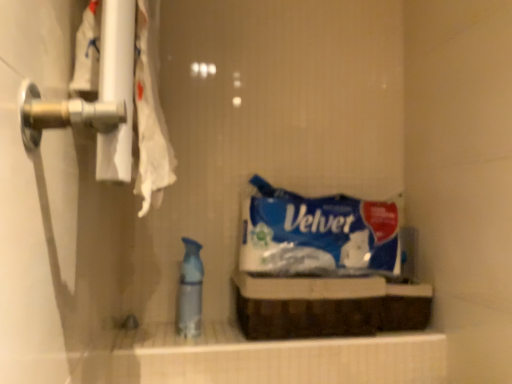
In order to face translucent plastic spray bottle at center, should I rotate leftwards or rightwards?

It's best to rotate left around 8.387 degrees.

Describe the element at coordinates (190, 290) in the screenshot. The image size is (512, 384). I see `translucent plastic spray bottle at center` at that location.

At what (x,y) coordinates should I click in order to perform the action: click on translucent plastic spray bottle at center. Please return your answer as a coordinate pair (x, y). The height and width of the screenshot is (384, 512). Looking at the image, I should click on click(x=190, y=290).

The height and width of the screenshot is (384, 512). What do you see at coordinates (318, 234) in the screenshot?
I see `blue paper towel at center` at bounding box center [318, 234].

Where is `blue paper towel at center`? Image resolution: width=512 pixels, height=384 pixels. blue paper towel at center is located at coordinates pos(318,234).

Where is `translucent plastic spray bottle at center`? The image size is (512, 384). translucent plastic spray bottle at center is located at coordinates (190, 290).

Considering the relative positions of translucent plastic spray bottle at center and blue paper towel at center in the image provided, is translucent plastic spray bottle at center to the left or to the right of blue paper towel at center?

In the image, translucent plastic spray bottle at center appears on the left side of blue paper towel at center.

Does translucent plastic spray bottle at center come behind blue paper towel at center?

→ No, translucent plastic spray bottle at center is in front of blue paper towel at center.

Is point (188, 294) positioned before point (322, 265)?

Yes, point (188, 294) is in front of point (322, 265).

From the picture: From the image's perspective, is translucent plastic spray bottle at center over blue paper towel at center?

No, from the image's perspective, translucent plastic spray bottle at center is not over blue paper towel at center.

From a real-world perspective, relative to blue paper towel at center, is translucent plastic spray bottle at center vertically above or below?

translucent plastic spray bottle at center is situated lower than blue paper towel at center in the real world.

Looking at their sizes, would you say translucent plastic spray bottle at center is wider or thinner than blue paper towel at center?

In the image, translucent plastic spray bottle at center appears to be more narrow than blue paper towel at center.

Considering the relative sizes of translucent plastic spray bottle at center and blue paper towel at center in the image provided, is translucent plastic spray bottle at center shorter than blue paper towel at center?

In fact, translucent plastic spray bottle at center may be taller than blue paper towel at center.

Does translucent plastic spray bottle at center have a larger size compared to blue paper towel at center?

Incorrect, translucent plastic spray bottle at center is not larger than blue paper towel at center.

Is translucent plastic spray bottle at center located outside blue paper towel at center?

translucent plastic spray bottle at center is positioned outside blue paper towel at center.

Is translucent plastic spray bottle at center next to blue paper towel at center?

There is a gap between translucent plastic spray bottle at center and blue paper towel at center.

Does translucent plastic spray bottle at center turn towards blue paper towel at center?

No, translucent plastic spray bottle at center is not aimed at blue paper towel at center.

Measure the distance between translucent plastic spray bottle at center and blue paper towel at center.

They are 11.81 inches apart.

The image size is (512, 384). I want to click on cleaning product on the left of blue paper towel at center, so click(190, 290).

Considering the positions of objects blue paper towel at center and translucent plastic spray bottle at center in the image provided, who is more to the right, blue paper towel at center or translucent plastic spray bottle at center?

blue paper towel at center.

Is blue paper towel at center closer to the viewer compared to translucent plastic spray bottle at center?

No, it is behind translucent plastic spray bottle at center.

Is point (367, 215) in front of point (192, 304)?

No, it is behind (192, 304).

From the image's perspective, which one is positioned lower, blue paper towel at center or translucent plastic spray bottle at center?

translucent plastic spray bottle at center is shown below in the image.

Based on the photo, from a real-world perspective, is blue paper towel at center above or below translucent plastic spray bottle at center?

Clearly, from a real-world perspective, blue paper towel at center is above translucent plastic spray bottle at center.

In terms of width, does blue paper towel at center look wider or thinner when compared to translucent plastic spray bottle at center?

In the image, blue paper towel at center appears to be wider than translucent plastic spray bottle at center.

Between blue paper towel at center and translucent plastic spray bottle at center, which one has less height?

With less height is blue paper towel at center.

Is blue paper towel at center smaller than translucent plastic spray bottle at center?

No, blue paper towel at center is not smaller than translucent plastic spray bottle at center.

Which is correct: blue paper towel at center is inside translucent plastic spray bottle at center, or outside of it?

blue paper towel at center is not inside translucent plastic spray bottle at center, it's outside.

Can you see blue paper towel at center touching translucent plastic spray bottle at center?

blue paper towel at center and translucent plastic spray bottle at center are not in contact.

Is blue paper towel at center oriented away from translucent plastic spray bottle at center?

No, translucent plastic spray bottle at center is not at the back of blue paper towel at center.

Measure the distance from blue paper towel at center to translucent plastic spray bottle at center.

blue paper towel at center is 29.99 centimeters away from translucent plastic spray bottle at center.

I want to click on cleaning product located on the left of blue paper towel at center, so click(x=190, y=290).

What are the coordinates of `cleaning product to the left of blue paper towel at center` in the screenshot? It's located at (190, 290).

You are a GUI agent. You are given a task and a screenshot of the screen. Output one action in this format:
    pyautogui.click(x=<x>, y=<y>)
    Task: Click on the snack positioned vertically above the translucent plastic spray bottle at center (from a real-world perspective)
    
    Given the screenshot: What is the action you would take?
    point(318,234)